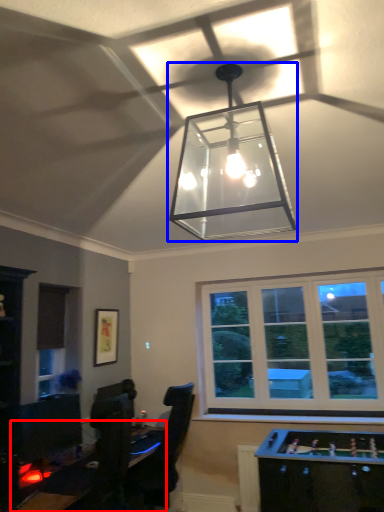
Question: Which object appears farthest to the camera in this image, table (highlighted by a red box) or lamp (highlighted by a blue box)?

Choices:
 (A) table
 (B) lamp

Answer: (A)